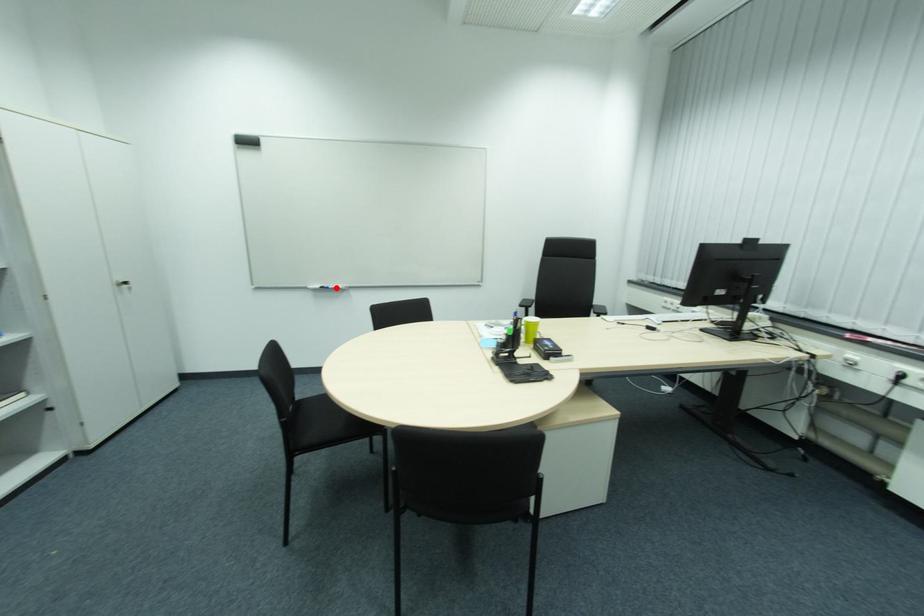
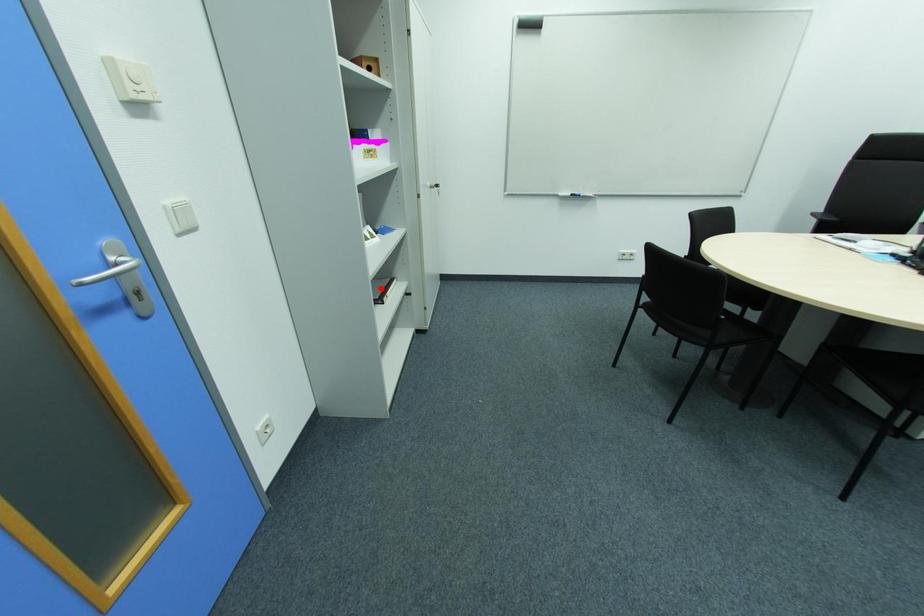
I am providing you with two images of the same scene from different viewpoints. A red point is marked on the first image and another point is marked on the second image. Do the highlighted points in image1 and image2 indicate the same real-world spot?

No